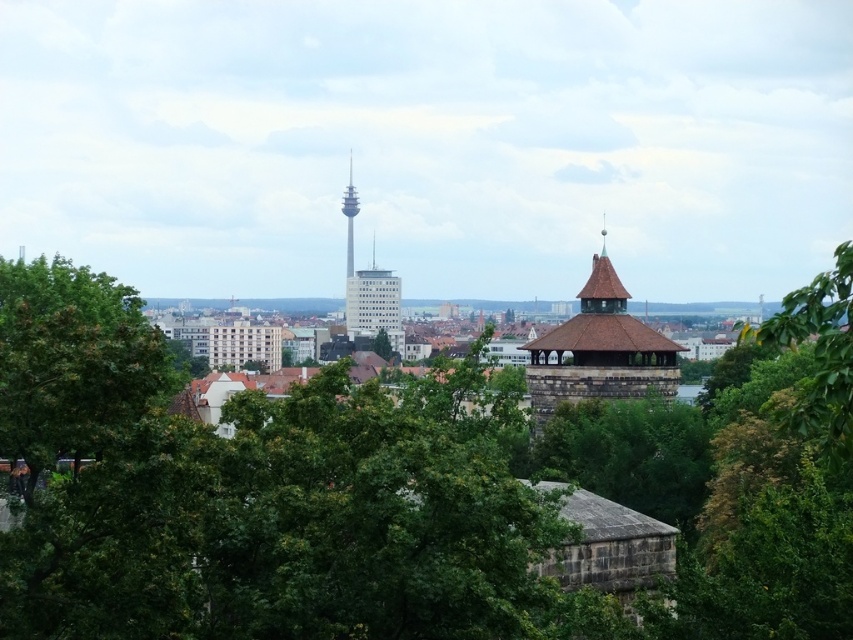
Question: Which object appears farthest from the camera in this image?

Choices:
 (A) green leafy tree at left
 (B) brown wooden tower at center
 (C) white glass building at center
 (D) green leafy tree at right

Answer: (C)

Question: Is green leafy tree at left to the right of smooth glass tower at center from the viewer's perspective?

Choices:
 (A) yes
 (B) no

Answer: (A)

Question: Which point is farther from the camera taking this photo?

Choices:
 (A) (357, 204)
 (B) (822, 358)
 (C) (380, 317)
 (D) (49, 396)

Answer: (A)

Question: Among these objects, which one is farthest from the camera?

Choices:
 (A) green leafy tree at right
 (B) white glass building at center
 (C) smooth glass tower at center
 (D) green leafy tree at left

Answer: (C)

Question: Does white glass building at center lie behind smooth glass tower at center?

Choices:
 (A) no
 (B) yes

Answer: (A)

Question: Does green leafy tree at right have a smaller size compared to smooth glass tower at center?

Choices:
 (A) no
 (B) yes

Answer: (A)